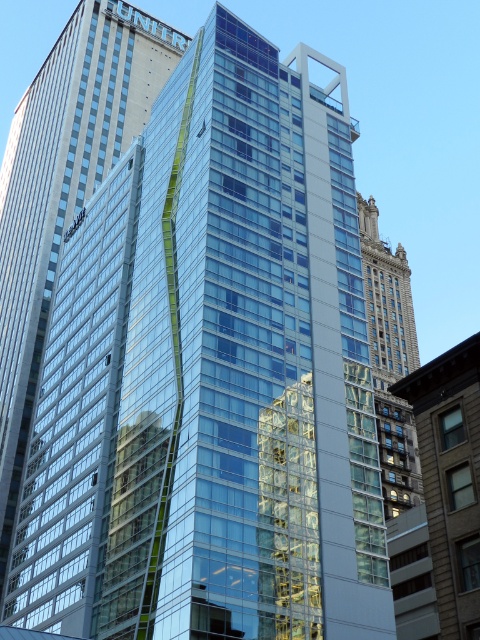
You are an architect analyzing the building layout. Which object is positioned higher in the image, the transparent glass building at center or the brown stone tower at center?

The transparent glass building at center is located above the brown stone tower at center, so it is positioned higher in the image.

You are an architect evaluating the design of the transparent glass building at center and the brown stone tower at center. Which building would you say has a greater height?

The transparent glass building at center is taller than the brown stone tower at center, so the transparent glass building at center has a greater height.